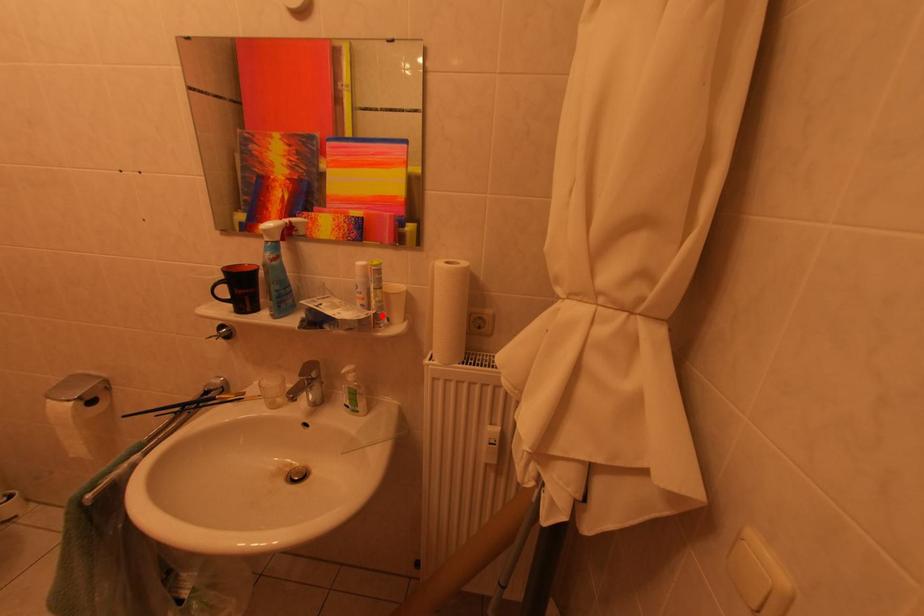
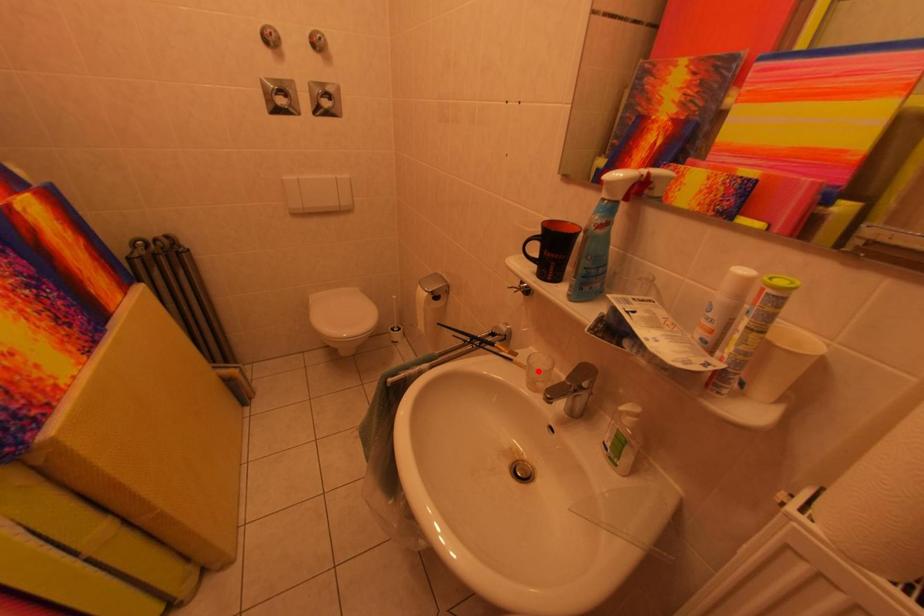
I am providing you with two images of the same scene from different viewpoints. A red point is marked on the first image and another point is marked on the second image. Do the highlighted points in image1 and image2 indicate the same real-world spot?

No